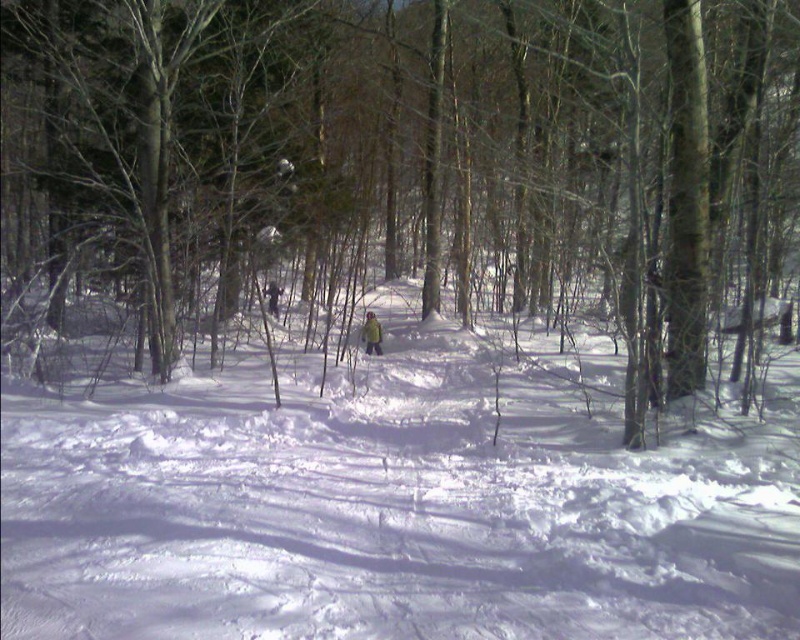
Does brown smooth tree at center have a larger size compared to white fluffy snow at center?

Yes.

What do you see at coordinates (404, 164) in the screenshot? The image size is (800, 640). I see `brown smooth tree at center` at bounding box center [404, 164].

At what (x,y) coordinates should I click in order to perform the action: click on brown smooth tree at center. Please return your answer as a coordinate pair (x, y). This screenshot has width=800, height=640. Looking at the image, I should click on (404, 164).

Is point (6, 308) farther from viewer compared to point (378, 326)?

No, it is in front of (378, 326).

How far apart are brown smooth tree at center and green fabric person at center?

brown smooth tree at center is 21.48 feet from green fabric person at center.

Locate an element on the screen. Image resolution: width=800 pixels, height=640 pixels. brown smooth tree at center is located at coordinates (404, 164).

At what (x,y) coordinates should I click in order to perform the action: click on brown smooth tree at center. Please return your answer as a coordinate pair (x, y). Looking at the image, I should click on (404, 164).

Who is positioned more to the right, white fluffy snow at center or green fabric person at center?

Positioned to the right is white fluffy snow at center.

Which is in front, point (74, 456) or point (366, 321)?

Positioned in front is point (74, 456).

What do you see at coordinates (396, 502) in the screenshot? I see `white fluffy snow at center` at bounding box center [396, 502].

At what (x,y) coordinates should I click in order to perform the action: click on white fluffy snow at center. Please return your answer as a coordinate pair (x, y). Image resolution: width=800 pixels, height=640 pixels. Looking at the image, I should click on point(396,502).